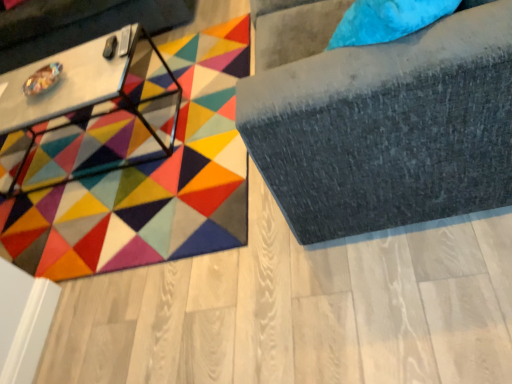
This screenshot has height=384, width=512. Find the location of `suede gray sofa at upper right`. suede gray sofa at upper right is located at coordinates (380, 120).

What do you see at coordinates (79, 24) in the screenshot? The height and width of the screenshot is (384, 512). I see `metallic silver swivel chair at left` at bounding box center [79, 24].

From the picture: Measure the distance between point (65, 17) and camera.

8.94 feet.

Measure the distance between white glossy table at upper left and camera.

They are 1.83 meters apart.

This screenshot has height=384, width=512. I want to click on suede gray sofa at upper right, so click(380, 120).

Considering the relative positions of suede gray sofa at upper right and multicolored felt mat at center in the image provided, is suede gray sofa at upper right behind multicolored felt mat at center?

No, the depth of suede gray sofa at upper right is less than that of multicolored felt mat at center.

From the image's perspective, relative to multicolored felt mat at center, is suede gray sofa at upper right above or below?

From the image's perspective, suede gray sofa at upper right appears above multicolored felt mat at center.

Between suede gray sofa at upper right and multicolored felt mat at center, which one has smaller size?

With smaller size is suede gray sofa at upper right.

Looking at this image, would you say suede gray sofa at upper right is inside or outside multicolored felt mat at center?

suede gray sofa at upper right is located beyond the bounds of multicolored felt mat at center.

From a real-world perspective, is white glossy table at upper left on multicolored felt mat at center?

Indeed, from a real-world perspective, white glossy table at upper left stands above multicolored felt mat at center.

Considering the sizes of objects white glossy table at upper left and multicolored felt mat at center in the image provided, who is shorter, white glossy table at upper left or multicolored felt mat at center?

Standing shorter between the two is multicolored felt mat at center.

Is multicolored felt mat at center at the back of white glossy table at upper left?

No, white glossy table at upper left is not facing the opposite direction of multicolored felt mat at center.

Does suede gray sofa at upper right have a smaller size compared to metallic silver swivel chair at left?

Yes, suede gray sofa at upper right is smaller than metallic silver swivel chair at left.

From a real-world perspective, who is located lower, suede gray sofa at upper right or metallic silver swivel chair at left?

metallic silver swivel chair at left.

Between suede gray sofa at upper right and metallic silver swivel chair at left, which one has smaller width?

suede gray sofa at upper right.

In order to click on furniture in front of the metallic silver swivel chair at left in this screenshot , I will do `click(380, 120)`.

Is multicolored felt mat at center not near suede gray sofa at upper right?

multicolored felt mat at center is near suede gray sofa at upper right, not far away.

Considering the positions of objects multicolored felt mat at center and suede gray sofa at upper right in the image provided, who is in front, multicolored felt mat at center or suede gray sofa at upper right?

suede gray sofa at upper right is closer to the camera.

In the scene shown: Considering the relative positions of multicolored felt mat at center and suede gray sofa at upper right in the image provided, is multicolored felt mat at center to the left of suede gray sofa at upper right from the viewer's perspective?

Yes.

Which point is more forward, (20,33) or (425,209)?

The point (425,209) is in front.

Where is `swivel chair that appears above the suede gray sofa at upper right (from the image's perspective)`? The width and height of the screenshot is (512, 384). swivel chair that appears above the suede gray sofa at upper right (from the image's perspective) is located at coordinates (79, 24).

From the image's perspective, is metallic silver swivel chair at left located beneath suede gray sofa at upper right?

Incorrect, from the image's perspective, metallic silver swivel chair at left is higher than suede gray sofa at upper right.

Is suede gray sofa at upper right in front of white glossy table at upper left?

Yes, suede gray sofa at upper right is closer to the viewer.

Would you say suede gray sofa at upper right is inside or outside white glossy table at upper left?

suede gray sofa at upper right is spatially situated outside white glossy table at upper left.

Which is behind, point (509, 200) or point (42, 67)?

Point (42, 67)

Between suede gray sofa at upper right and white glossy table at upper left, which one has more height?

suede gray sofa at upper right is taller.

Is white glossy table at upper left located outside metallic silver swivel chair at left?

Yes, white glossy table at upper left is not within metallic silver swivel chair at left.

From their relative heights in the image, would you say white glossy table at upper left is taller or shorter than metallic silver swivel chair at left?

In the image, white glossy table at upper left appears to be shorter than metallic silver swivel chair at left.

How much distance is there between white glossy table at upper left and metallic silver swivel chair at left?

white glossy table at upper left and metallic silver swivel chair at left are 26.33 inches apart from each other.

Is white glossy table at upper left looking in the opposite direction of metallic silver swivel chair at left?

No, white glossy table at upper left's orientation is not away from metallic silver swivel chair at left.

Image resolution: width=512 pixels, height=384 pixels. I want to click on mat behind the suede gray sofa at upper right, so click(150, 181).

I want to click on mat that is in front of the white glossy table at upper left, so click(150, 181).

Looking at the image, which one is located further to metallic silver swivel chair at left, white glossy table at upper left or multicolored felt mat at center?

The object further to metallic silver swivel chair at left is multicolored felt mat at center.

From the image, which object appears to be nearer to suede gray sofa at upper right, multicolored felt mat at center or metallic silver swivel chair at left?

multicolored felt mat at center is closer to suede gray sofa at upper right.

Based on their spatial positions, is suede gray sofa at upper right or white glossy table at upper left closer to metallic silver swivel chair at left?

white glossy table at upper left lies closer to metallic silver swivel chair at left than the other object.

Estimate the real-world distances between objects in this image. Which object is closer to multicolored felt mat at center, metallic silver swivel chair at left or white glossy table at upper left?

white glossy table at upper left lies closer to multicolored felt mat at center than the other object.

Based on their spatial positions, is white glossy table at upper left or multicolored felt mat at center further from suede gray sofa at upper right?

white glossy table at upper left.

Estimate the real-world distances between objects in this image. Which object is further from suede gray sofa at upper right, metallic silver swivel chair at left or white glossy table at upper left?

Among the two, metallic silver swivel chair at left is located further to suede gray sofa at upper right.

Based on their spatial positions, is metallic silver swivel chair at left or multicolored felt mat at center closer to white glossy table at upper left?

The object closer to white glossy table at upper left is multicolored felt mat at center.

Which object lies further to the anchor point suede gray sofa at upper right, multicolored felt mat at center or white glossy table at upper left?

The object further to suede gray sofa at upper right is white glossy table at upper left.

Identify the location of table between metallic silver swivel chair at left and suede gray sofa at upper right in the horizontal direction. The image size is (512, 384). (x=82, y=97).

In order to click on mat between white glossy table at upper left and suede gray sofa at upper right from left to right in this screenshot , I will do `click(150, 181)`.

Where is `table between metallic silver swivel chair at left and multicolored felt mat at center in the up-down direction`? The image size is (512, 384). table between metallic silver swivel chair at left and multicolored felt mat at center in the up-down direction is located at coordinates (82, 97).

The width and height of the screenshot is (512, 384). Identify the location of mat between metallic silver swivel chair at left and suede gray sofa at upper right. (150, 181).